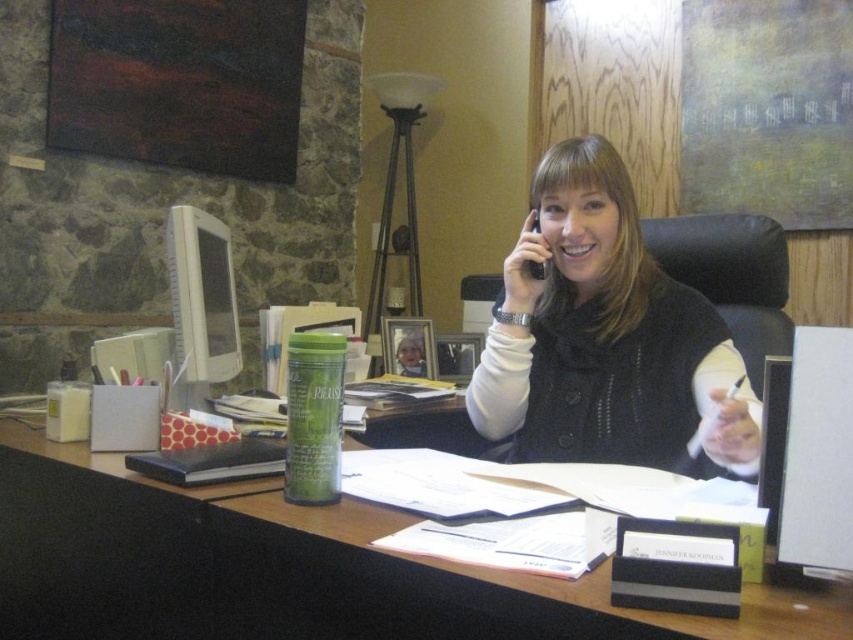
Is point (581, 193) in front of point (534, 260)?

Yes, point (581, 193) is closer to viewer.

Measure the distance between point (613, 259) and camera.

Point (613, 259) is 1.46 meters from camera.

This screenshot has height=640, width=853. In order to click on matte black vest at center in this screenshot , I will do `click(602, 336)`.

Is point (233, 621) closer to viewer compared to point (613, 179)?

Yes, point (233, 621) is in front of point (613, 179).

Does wooden desk at center have a greater height compared to matte black vest at center?

No.

At what (x,y) coordinates should I click in order to perform the action: click on wooden desk at center. Please return your answer as a coordinate pair (x, y). Looking at the image, I should click on (289, 568).

This screenshot has width=853, height=640. Identify the location of wooden desk at center. (289, 568).

Which is in front, point (306, 618) or point (538, 276)?

Point (306, 618)

Is the position of wooden desk at center less distant than that of black plastic phone at upper center?

Yes, wooden desk at center is in front of black plastic phone at upper center.

Who is more forward, (200, 532) or (535, 212)?

Point (200, 532)

This screenshot has height=640, width=853. What are the coordinates of `wooden desk at center` in the screenshot? It's located at (289, 568).